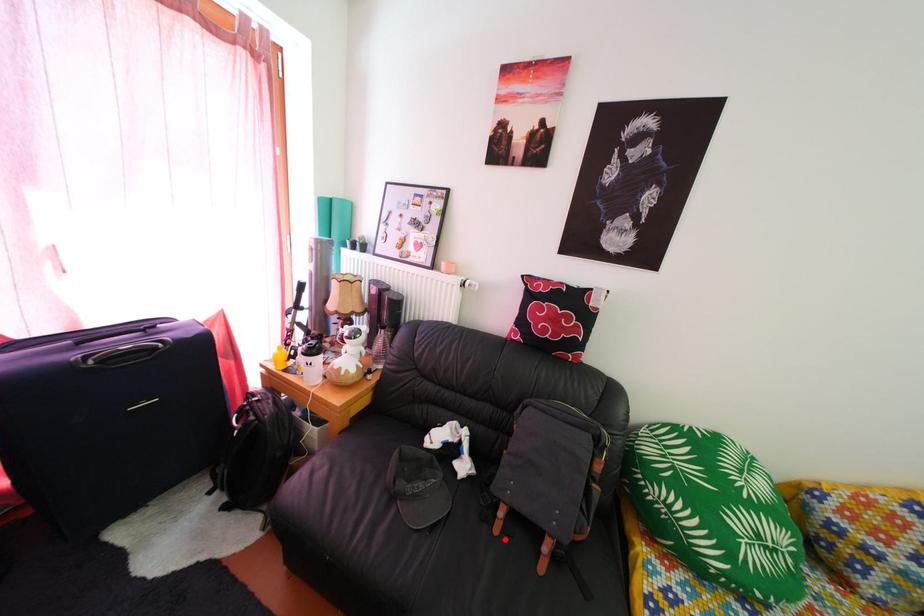
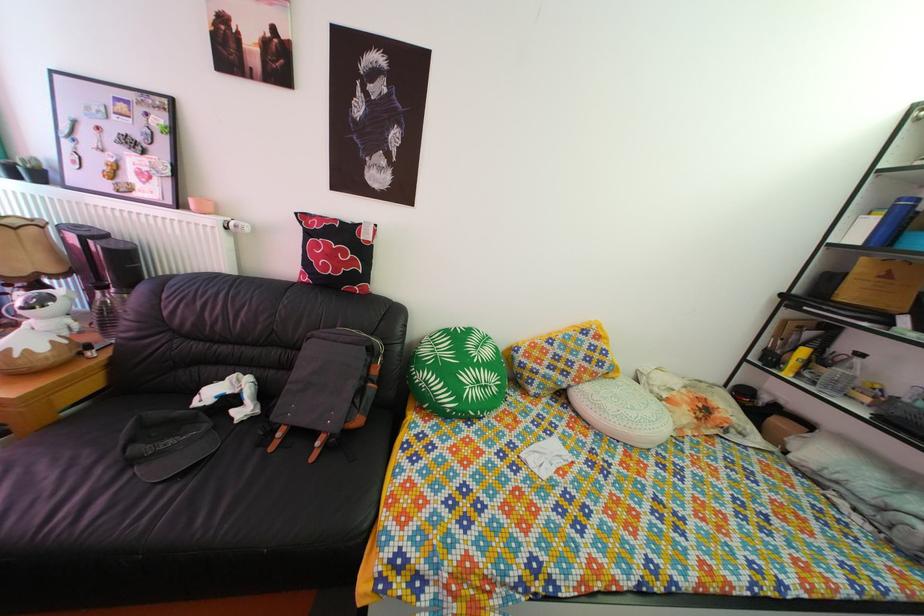
Question: I am providing you with two images of the same scene from different viewpoints. A red point is marked on the first image. Is the red point's position out of view in image 2?

Choices:
 (A) Yes
 (B) No

Answer: (B)